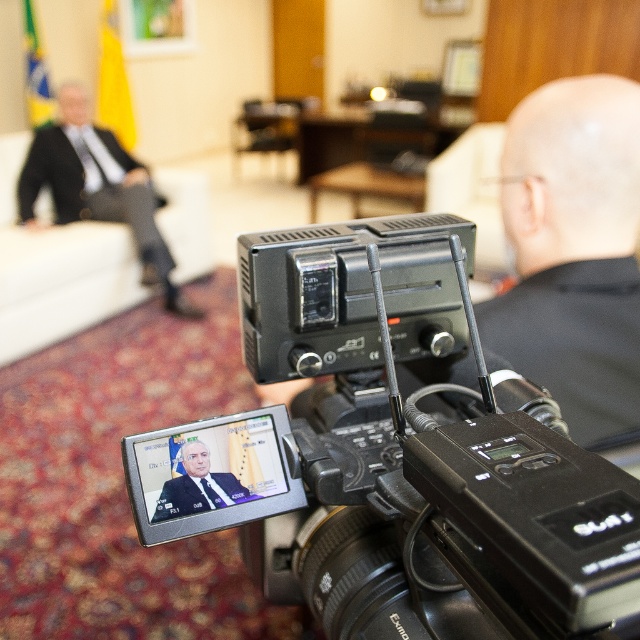
You are a photographer at a formal event. You see the black plastic camera at center and the black suit at left. Which object is positioned more to the right side of the scene?

The black plastic camera at center is positioned to the right of the black suit at left, so the black plastic camera at center is more to the right side of the scene.

You are a camera operator who needs to adjust the camera focus to capture both the black suit at left and the dark blue suit at center clearly. Given that the camera has a depth of field that can cover objects within a 4 meter range, will both subjects be in focus?

The distance between the black suit at left and dark blue suit at center is 3.71 meters, which is within the camera lens depth of field range of 4 meters. Therefore, both subjects will be in focus.

You are a camera operator who needs to adjust the focus of the black plastic camera at center to capture the dark blue suit at center clearly. Given the distance between them is 10.63 inches, can you confirm if this distance is sufficient for the camera to focus properly?

The black plastic camera at center is 10.63 inches from the dark blue suit at center. Since most professional cameras can focus effectively at distances of 10 inches or more, this distance should be sufficient for clear focus.